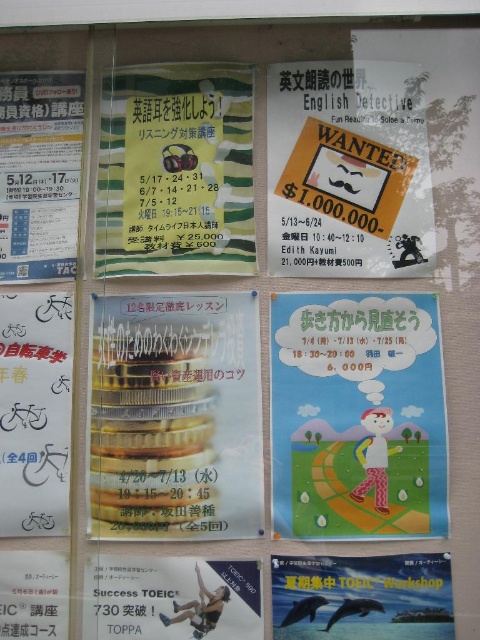
Consider the image. You are organizing a school event and need to hang two items on the bulletin board. You have a matte paper wanted poster at center and a white paper bicycle at left. Which item requires more space on the bulletin board?

The matte paper wanted poster at center requires more space on the bulletin board because it is larger in size than the white paper bicycle at left.

You are looking at the bulletin board and see the matte paper wanted poster at center and the white paper bicycle at left. Which object is positioned more to the left?

The white paper bicycle at left is positioned more to the left than the matte paper wanted poster at center.

You are standing in front of the bulletin board and notice two points marked on it. One is at coordinate point (112, 106) and the other is at point (61, 589). Which point is closer to your eyes?

Point (112, 106) is further to the camera than point (61, 589), so the point closer to your eyes is point (61, 589).